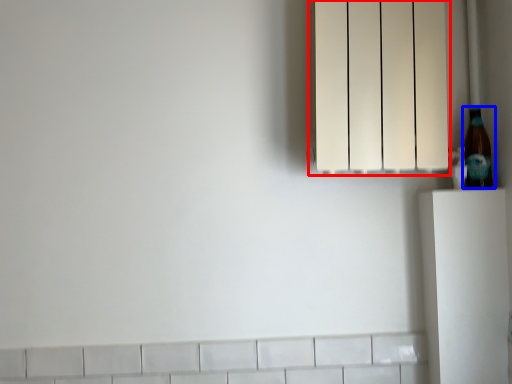
Question: Among these objects, which one is nearest to the camera, lamp (highlighted by a red box) or bottle (highlighted by a blue box)?

Choices:
 (A) lamp
 (B) bottle

Answer: (A)